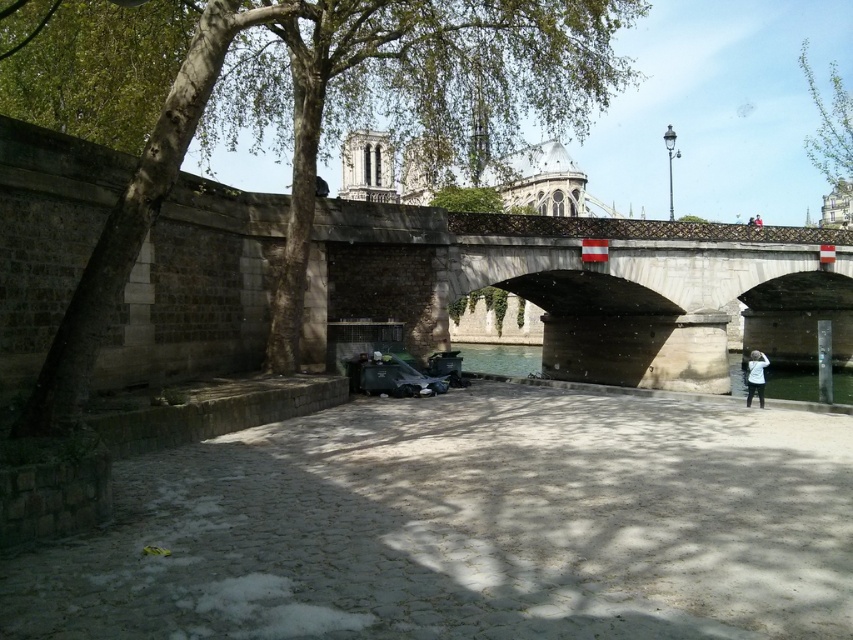
Question: Which is farther from the white matte jacket at lower right?

Choices:
 (A) clear concrete waterway at center
 (B) green leafy tree at upper right
 (C) green leafy tree at center

Answer: (B)

Question: Is clear concrete waterway at center closer to the viewer compared to white matte jacket at lower right?

Choices:
 (A) yes
 (B) no

Answer: (B)

Question: Which point is farther to the camera?

Choices:
 (A) (749, 387)
 (B) (509, 8)
 (C) (845, 385)
 (D) (840, 109)

Answer: (D)

Question: Can you confirm if clear concrete waterway at center is positioned to the right of white matte jacket at lower right?

Choices:
 (A) yes
 (B) no

Answer: (B)

Question: Is clear concrete waterway at center wider than white matte jacket at lower right?

Choices:
 (A) yes
 (B) no

Answer: (A)

Question: Which point is farther from the camera taking this photo?

Choices:
 (A) click(833, 346)
 (B) click(845, 400)

Answer: (A)